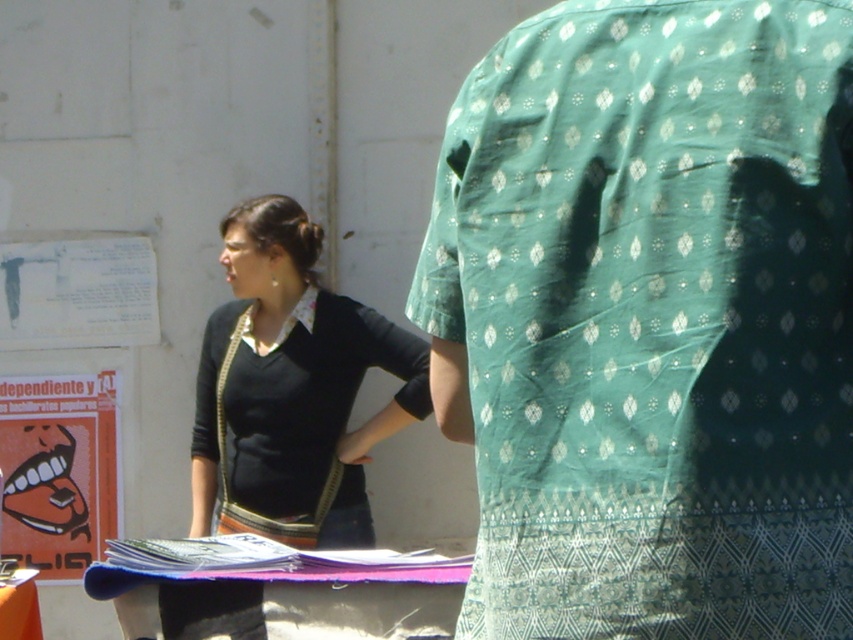
Locate an element on the screen. The height and width of the screenshot is (640, 853). green printed fabric at center is located at coordinates (651, 320).

Who is positioned more to the right, green printed fabric at center or black jersey at center?

green printed fabric at center

Identify the location of green printed fabric at center. Image resolution: width=853 pixels, height=640 pixels. pos(651,320).